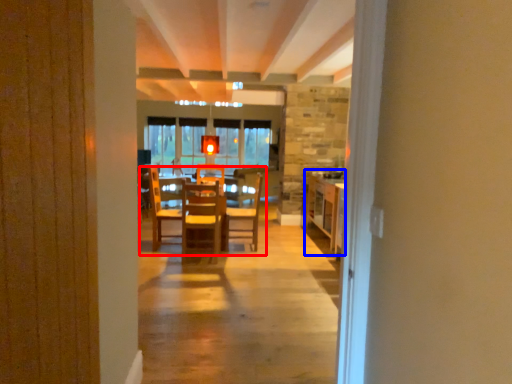
Question: Which of the following is the farthest to the observer, table (highlighted by a red box) or table (highlighted by a blue box)?

Choices:
 (A) table
 (B) table

Answer: (B)